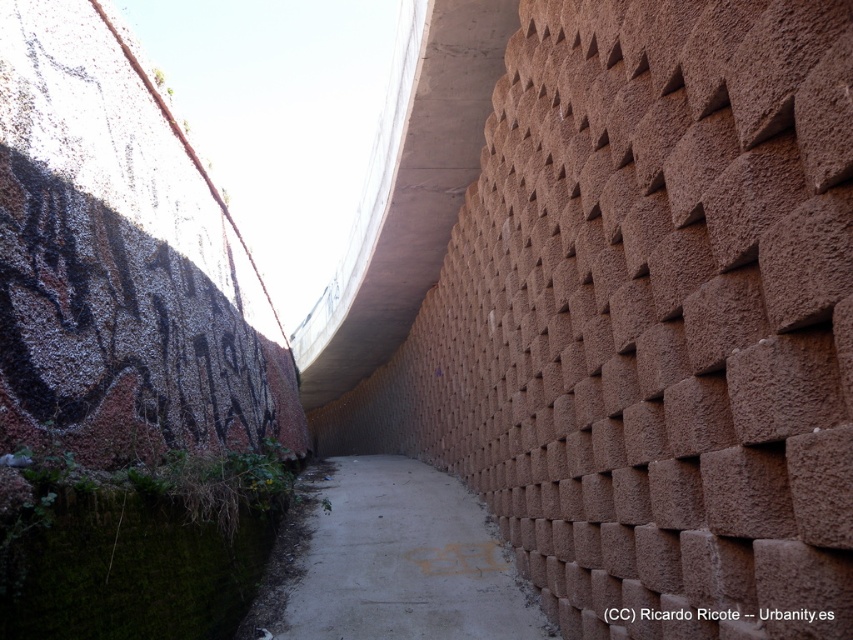
Who is more forward, (364,253) or (643,614)?

Point (643,614) is more forward.

Who is lower down, concrete at upper center or black graffiti at upper left?

Positioned lower is black graffiti at upper left.

This screenshot has width=853, height=640. What do you see at coordinates (407, 189) in the screenshot?
I see `concrete at upper center` at bounding box center [407, 189].

This screenshot has height=640, width=853. Identify the location of concrete at upper center. (407, 189).

Does concrete sidewalk at center have a smaller size compared to black graffiti at upper left?

Actually, concrete sidewalk at center might be larger than black graffiti at upper left.

Which is in front, point (387, 522) or point (775, 616)?

Point (775, 616) is more forward.

Where is `concrete sidewalk at center`? Image resolution: width=853 pixels, height=640 pixels. concrete sidewalk at center is located at coordinates (399, 560).

Measure the distance between point [460,60] and camera.

The distance of point [460,60] from camera is 15.73 feet.

Is the position of concrete at upper center less distant than that of concrete sidewalk at center?

Yes, it is in front of concrete sidewalk at center.

Is point (393, 179) behind point (357, 540)?

Yes, point (393, 179) is behind point (357, 540).

The height and width of the screenshot is (640, 853). Find the location of `concrete at upper center`. concrete at upper center is located at coordinates (407, 189).